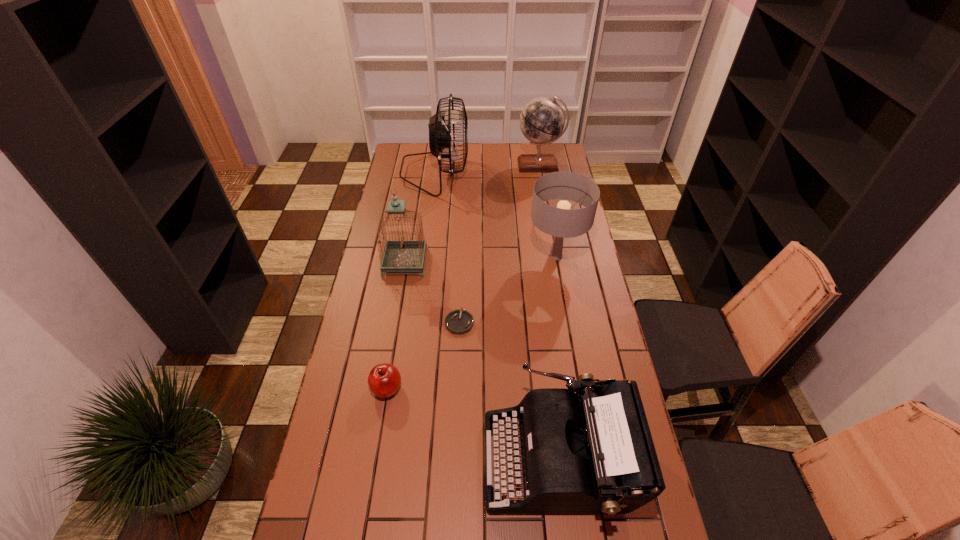
At what (x,y) coordinates should I click in order to perform the action: click on fan. Please return your answer as a coordinate pair (x, y). Looking at the image, I should click on (441, 135).

The height and width of the screenshot is (540, 960). Find the location of `globe`. globe is located at coordinates (542, 120).

Locate an element on the screen. birdcage is located at coordinates (402, 255).

The height and width of the screenshot is (540, 960). In order to click on lampshade in this screenshot , I will do `click(561, 222)`.

Find the location of a particular element. the fifth tallest object is located at coordinates (591, 452).

The image size is (960, 540). Find the location of `the second shortest object`. the second shortest object is located at coordinates (384, 380).

I want to click on the fifth farthest object, so click(x=459, y=322).

Identify the location of ashtray. (459, 322).

Locate an element on the screen. The height and width of the screenshot is (540, 960). vacant space positioned in front of the fan, directing airflow is located at coordinates (529, 173).

The height and width of the screenshot is (540, 960). I want to click on vacant space situated at the equator of the globe, so click(x=547, y=207).